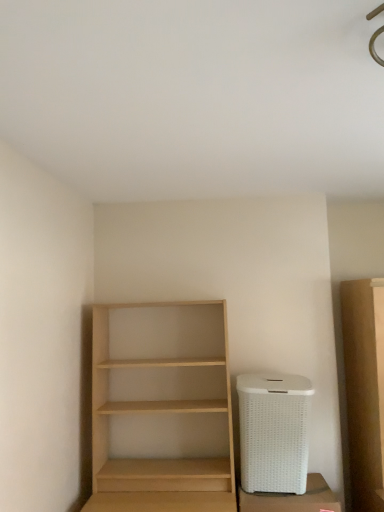
Image resolution: width=384 pixels, height=512 pixels. Describe the element at coordinates (161, 408) in the screenshot. I see `light wood shelf at center` at that location.

This screenshot has height=512, width=384. Describe the element at coordinates (292, 499) in the screenshot. I see `white wicker trash can at lower right` at that location.

You are a GUI agent. You are given a task and a screenshot of the screen. Output one action in this format:
    pyautogui.click(x=<x>, y=<y>)
    Task: Click on the white wicker laundry basket at lower right
    The height and width of the screenshot is (512, 384).
    Given the screenshot: What is the action you would take?
    pyautogui.click(x=274, y=432)

Considering the sizes of objects white wicker laundry basket at lower right and light wood shelf at center in the image provided, who is smaller, white wicker laundry basket at lower right or light wood shelf at center?

white wicker laundry basket at lower right is smaller.

From the image's perspective, is white wicker laundry basket at lower right under light wood shelf at center?

Correct, white wicker laundry basket at lower right appears lower than light wood shelf at center in the image.

Does white wicker laundry basket at lower right appear on the right side of light wood shelf at center?

Indeed, white wicker laundry basket at lower right is positioned on the right side of light wood shelf at center.

From a real-world perspective, does light wood shelf at center stand above white wicker trash can at lower right?

Indeed, from a real-world perspective, light wood shelf at center stands above white wicker trash can at lower right.

Considering the sizes of objects light wood shelf at center and white wicker trash can at lower right in the image provided, who is thinner, light wood shelf at center or white wicker trash can at lower right?

With smaller width is white wicker trash can at lower right.

From the image's perspective, is light wood shelf at center located above or below white wicker trash can at lower right?

Clearly, from the image's perspective, light wood shelf at center is above white wicker trash can at lower right.

Is light wood shelf at center shorter than white wicker trash can at lower right?

Incorrect, the height of light wood shelf at center does not fall short of that of white wicker trash can at lower right.

At what (x,y) coordinates should I click in order to perform the action: click on appliance behind the white wicker trash can at lower right. Please return your answer as a coordinate pair (x, y). Looking at the image, I should click on (274, 432).

Is white wicker laundry basket at lower right situated inside white wicker trash can at lower right or outside?

white wicker laundry basket at lower right lies outside white wicker trash can at lower right.

Can you confirm if white wicker laundry basket at lower right is smaller than white wicker trash can at lower right?

Actually, white wicker laundry basket at lower right might be larger than white wicker trash can at lower right.

Is white wicker laundry basket at lower right to the left of white wicker trash can at lower right from the viewer's perspective?

Indeed, white wicker laundry basket at lower right is positioned on the left side of white wicker trash can at lower right.

Are white wicker trash can at lower right and white wicker laundry basket at lower right far apart?

No, white wicker trash can at lower right is not far from white wicker laundry basket at lower right.

Is white wicker trash can at lower right facing towards white wicker laundry basket at lower right?

No, white wicker trash can at lower right does not turn towards white wicker laundry basket at lower right.

Does white wicker trash can at lower right come behind white wicker laundry basket at lower right?

No, it is not.

Based on the photo, how much distance is there between white wicker trash can at lower right and light wood shelf at center?

The distance of white wicker trash can at lower right from light wood shelf at center is 25.85 inches.

How different are the orientations of white wicker trash can at lower right and light wood shelf at center in degrees?

There is a 1.47-degree angle between the facing directions of white wicker trash can at lower right and light wood shelf at center.

Is white wicker trash can at lower right turned away from light wood shelf at center?

No, light wood shelf at center is not at the back of white wicker trash can at lower right.

From a real-world perspective, is white wicker trash can at lower right physically above light wood shelf at center?

No, from a real-world perspective, white wicker trash can at lower right is not above light wood shelf at center.

From the image's perspective, who appears lower, light wood shelf at center or white wicker laundry basket at lower right?

white wicker laundry basket at lower right is shown below in the image.

Is light wood shelf at center far away from white wicker laundry basket at lower right?

No, light wood shelf at center is not far from white wicker laundry basket at lower right.

I want to click on shelf that is above the white wicker laundry basket at lower right (from a real-world perspective), so pyautogui.click(x=161, y=408).

Locate an element on the screen. The image size is (384, 512). appliance below the light wood shelf at center (from the image's perspective) is located at coordinates (274, 432).

Locate an element on the screen. Image resolution: width=384 pixels, height=512 pixels. shelf in front of the white wicker trash can at lower right is located at coordinates tap(161, 408).

From the image, which object appears to be nearer to white wicker trash can at lower right, white wicker laundry basket at lower right or light wood shelf at center?

white wicker laundry basket at lower right.

Looking at the image, which one is located closer to white wicker laundry basket at lower right, light wood shelf at center or white wicker trash can at lower right?

white wicker trash can at lower right lies closer to white wicker laundry basket at lower right than the other object.

Looking at the image, which one is located further to light wood shelf at center, white wicker trash can at lower right or white wicker laundry basket at lower right?

white wicker trash can at lower right lies further to light wood shelf at center than the other object.

When comparing their distances from light wood shelf at center, does white wicker laundry basket at lower right or white wicker trash can at lower right seem further?

Among the two, white wicker trash can at lower right is located further to light wood shelf at center.

Looking at this image, when comparing their distances from white wicker laundry basket at lower right, does white wicker trash can at lower right or light wood shelf at center seem closer?

white wicker trash can at lower right is positioned closer to the anchor white wicker laundry basket at lower right.

Looking at the image, which one is located closer to white wicker trash can at lower right, light wood shelf at center or white wicker laundry basket at lower right?

white wicker laundry basket at lower right is closer to white wicker trash can at lower right.

This screenshot has width=384, height=512. In order to click on appliance between light wood shelf at center and white wicker trash can at lower right in this screenshot , I will do `click(274, 432)`.